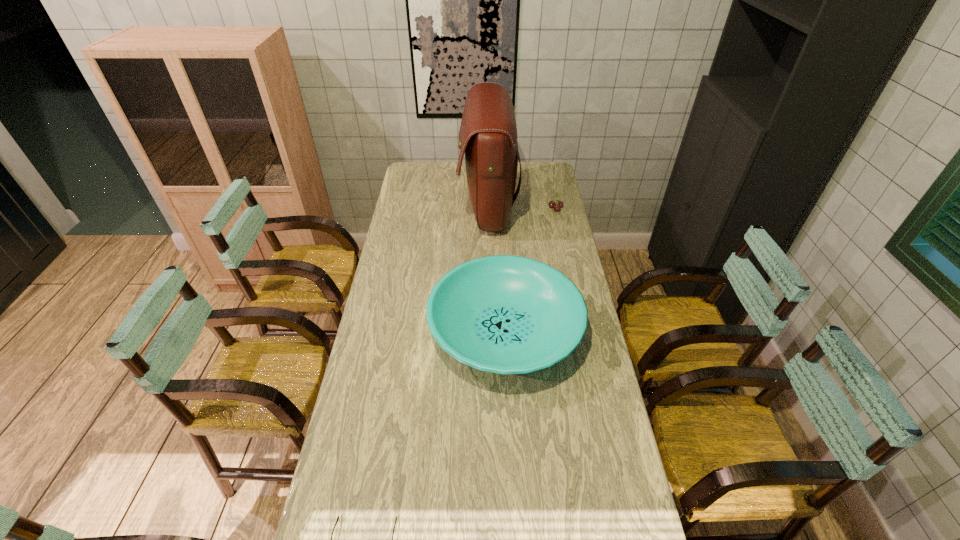
Locate an element on the screen. The image size is (960, 540). free location that satisfies the following two spatial constraints: 1. on the open flap of the tallest object; 2. on the right side of the third farthest object is located at coordinates [x=491, y=330].